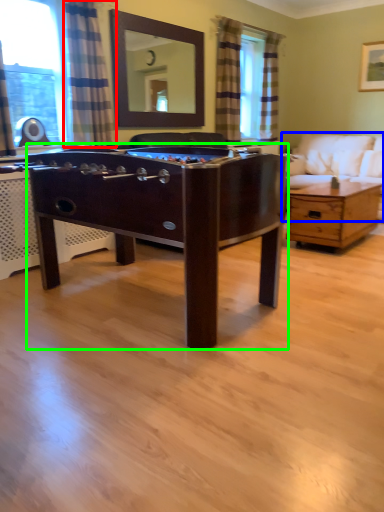
Question: Considering the real-world distances, which object is farthest from curtain (highlighted by a red box)? studio couch (highlighted by a blue box) or desk (highlighted by a green box)?

Choices:
 (A) studio couch
 (B) desk

Answer: (A)